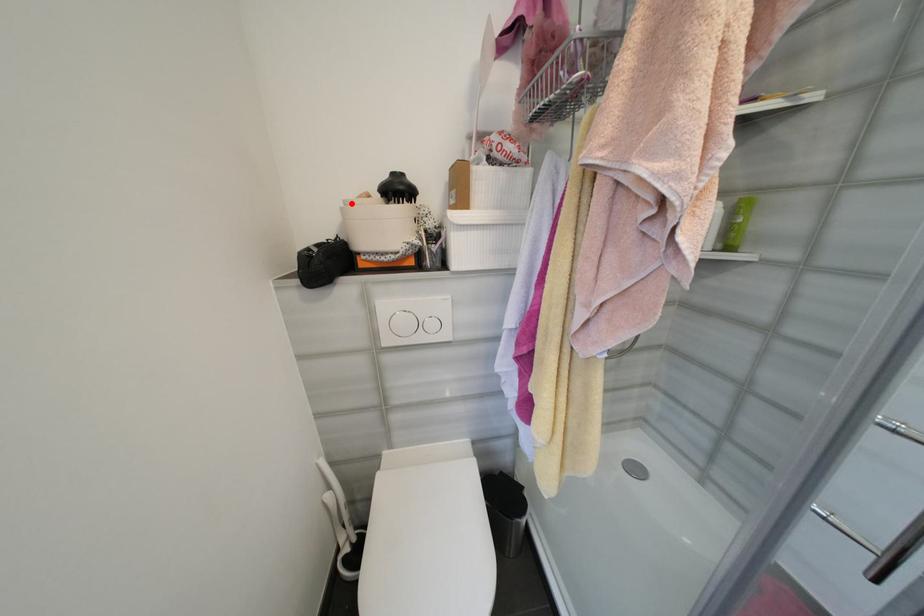
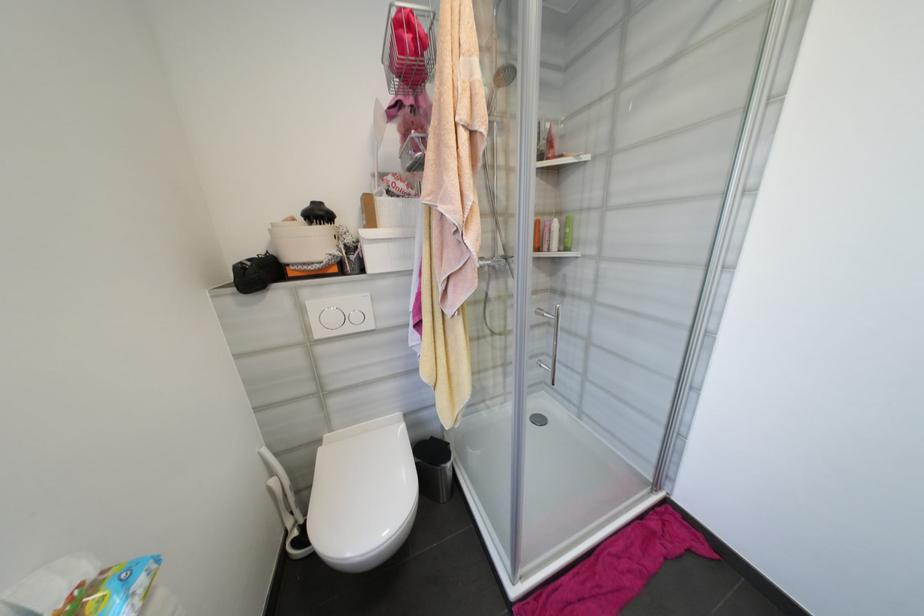
Locate, in the second image, the point that corresponds to the highlighted location in the first image.

(280, 225)